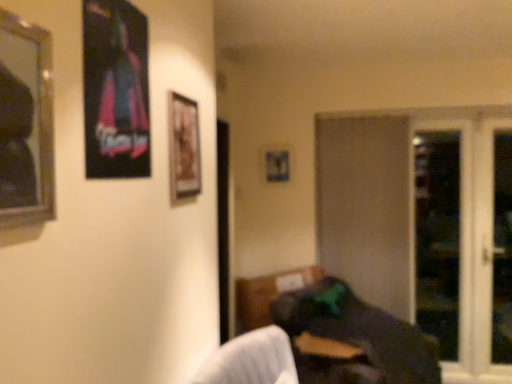
Question: From a real-world perspective, is metallic silver picture frame at center, acting as the 1th picture frame starting from the back, located higher than silver-framed mirror at left, which is the first picture frame from front to back?

Choices:
 (A) no
 (B) yes

Answer: (A)

Question: From the image's perspective, would you say metallic silver picture frame at center, acting as the 1th picture frame starting from the back, is positioned over silver-framed mirror at left, which is the first picture frame from front to back?

Choices:
 (A) no
 (B) yes

Answer: (B)

Question: Does metallic silver picture frame at center, acting as the fourth picture frame starting from the front, have a larger size compared to silver-framed mirror at left, arranged as the 4th picture frame when viewed from the back?

Choices:
 (A) yes
 (B) no

Answer: (B)

Question: Considering the relative sizes of metallic silver picture frame at center, which is the first picture frame from right to left, and silver-framed mirror at left, which is the first picture frame from front to back, in the image provided, is metallic silver picture frame at center, which is the first picture frame from right to left, wider than silver-framed mirror at left, which is the first picture frame from front to back,?

Choices:
 (A) no
 (B) yes

Answer: (A)

Question: Does metallic silver picture frame at center, acting as the 1th picture frame starting from the back, appear on the right side of silver-framed mirror at left, arranged as the 4th picture frame when viewed from the back?

Choices:
 (A) no
 (B) yes

Answer: (B)

Question: From a real-world perspective, is wooden framed picture at center, positioned as the 2th picture frame in back-to-front order, positioned above or below transparent glass screen door at right, acting as the third screen door starting from the left?

Choices:
 (A) below
 (B) above

Answer: (B)

Question: Is wooden framed picture at center, the 3th picture frame positioned from the left, spatially inside transparent glass screen door at right, acting as the third screen door starting from the left, or outside of it?

Choices:
 (A) inside
 (B) outside

Answer: (B)

Question: Is wooden framed picture at center, arranged as the third picture frame when viewed from the front, taller or shorter than transparent glass screen door at right, the 2th screen door positioned from the right?

Choices:
 (A) tall
 (B) short

Answer: (B)

Question: Considering their positions, is wooden framed picture at center, positioned as the 2th picture frame in back-to-front order, located in front of or behind transparent glass screen door at right, acting as the third screen door starting from the left?

Choices:
 (A) front
 (B) behind

Answer: (A)

Question: Is point (456, 215) positioned closer to the camera than point (135, 150)?

Choices:
 (A) farther
 (B) closer

Answer: (A)

Question: From a real-world perspective, is transparent glass screen door at right, the 2th screen door positioned from the right, positioned above or below metallic poster at upper left, placed as the third picture frame when sorted from back to front?

Choices:
 (A) above
 (B) below

Answer: (B)

Question: Choose the correct answer: Is transparent glass screen door at right, the 2th screen door positioned from the right, inside metallic poster at upper left, placed as the third picture frame when sorted from back to front, or outside it?

Choices:
 (A) outside
 (B) inside

Answer: (A)

Question: Relative to metallic poster at upper left, the second picture frame in the left-to-right sequence, is transparent glass screen door at right, acting as the third screen door starting from the left, in front or behind?

Choices:
 (A) front
 (B) behind

Answer: (B)

Question: In terms of width, does silver-framed mirror at left, arranged as the first picture frame when viewed from the left, look wider or thinner when compared to beige matte screen door at center-right, the 4th screen door in the right-to-left sequence?

Choices:
 (A) wide
 (B) thin

Answer: (B)

Question: Considering their positions, is silver-framed mirror at left, arranged as the first picture frame when viewed from the left, located in front of or behind beige matte screen door at center-right, which ranks as the 1th screen door in left-to-right order?

Choices:
 (A) behind
 (B) front

Answer: (B)